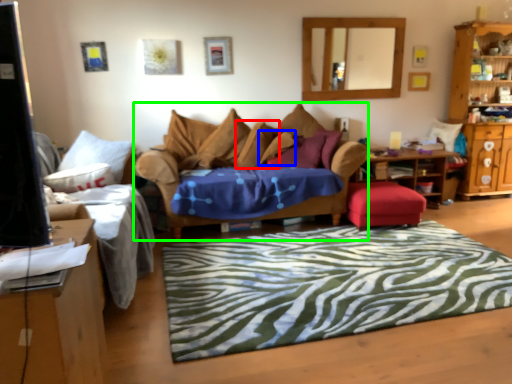
Question: Considering the real-world distances, which object is closest to pillow (highlighted by a red box)? pillow (highlighted by a blue box) or studio couch (highlighted by a green box).

Choices:
 (A) pillow
 (B) studio couch

Answer: (A)